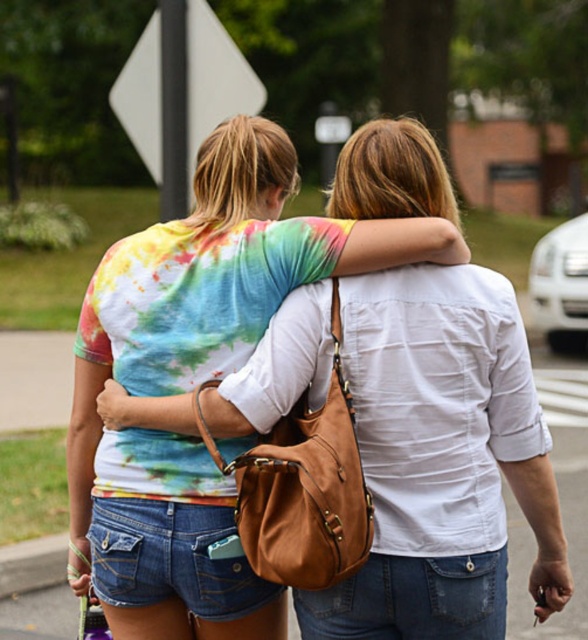
You are standing at the origin point of the coordinate system. You see a point at coordinate point [441,460]. What object is located at that coordinate point?

The point at coordinate point [441,460] corresponds to the tie dye fabric shirt at center.